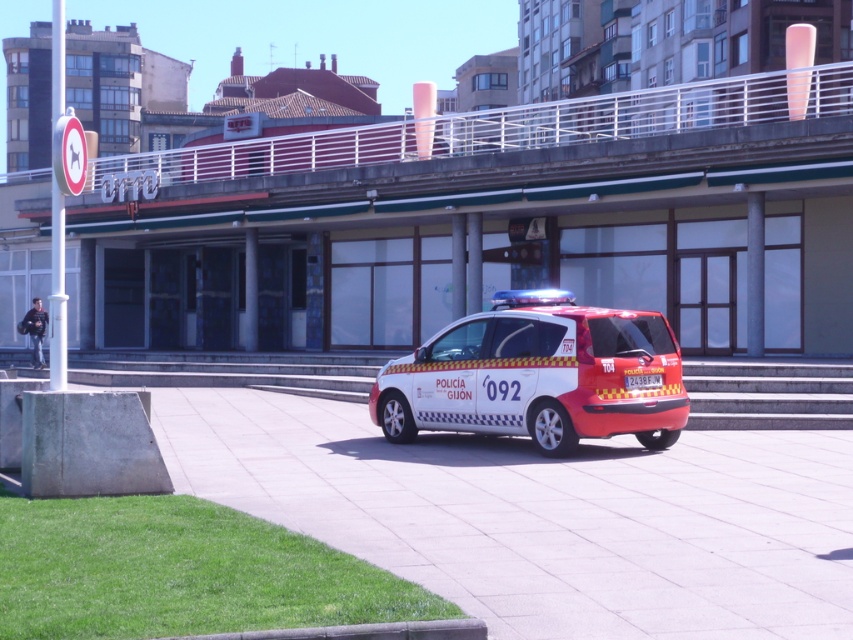
Question: Based on their relative distances, which object is nearer to the white glossy police car at center?

Choices:
 (A) white tile pavement at center
 (B) white plastic license plate at center

Answer: (B)

Question: Can you confirm if white tile pavement at center is positioned above white glossy police car at center?

Choices:
 (A) yes
 (B) no

Answer: (B)

Question: Which object is positioned farthest from the white glossy police car at center?

Choices:
 (A) white plastic license plate at center
 (B) white tile pavement at center

Answer: (B)

Question: Can you confirm if white glossy police car at center is thinner than white plastic license plate at center?

Choices:
 (A) yes
 (B) no

Answer: (B)

Question: Does white glossy police car at center appear on the left side of white plastic license plate at center?

Choices:
 (A) yes
 (B) no

Answer: (A)

Question: Which point is farther to the camera?

Choices:
 (A) 460,320
 (B) 741,508

Answer: (A)